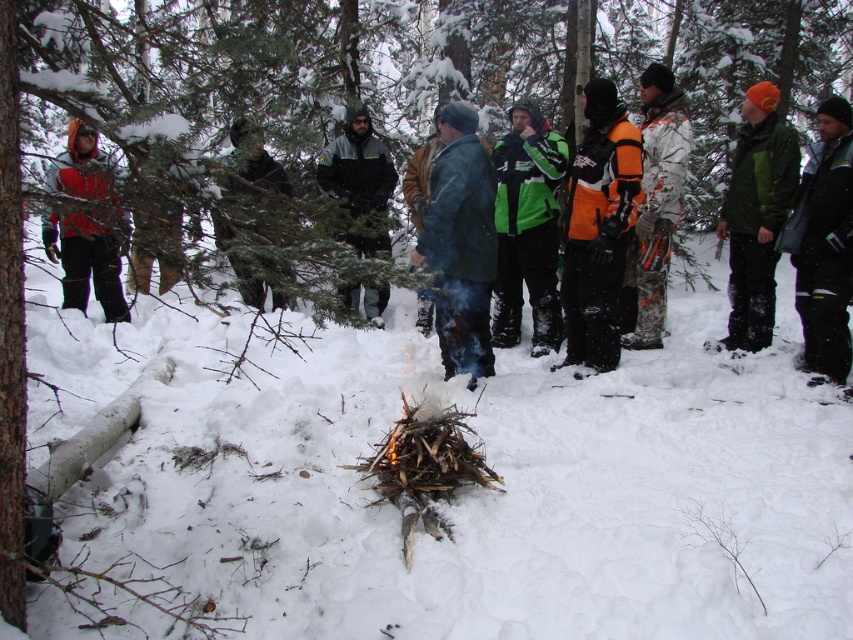
Looking at this image, you are a photographer standing in the snowy forest scene. You want to take a photo that includes both the camouflage jacket at center and the dark green jacket at center. Which jacket will appear larger in the photo?

The camouflage jacket at center will appear larger in the photo because it is much taller than the dark green jacket at center.

You are standing at the edge of the snowy forest scene and want to hand a hot drink to both the person wearing the camouflage jacket at center and the dark green jacket at center. If you can only carry the drink 10 feet, which person should you approach first?

The camouflage jacket at center is 12.89 feet away from dark green jacket at center. Since you can only carry the drink 10 feet, you cannot reach either of them without dropping the drink first. However, if you must choose the closer one, you need to determine their individual distances from your starting point. But the given information only states the distance between the two jackets, not their positions relative to you. Therefore, with the provided data, it is impossible to determine who is closer to you